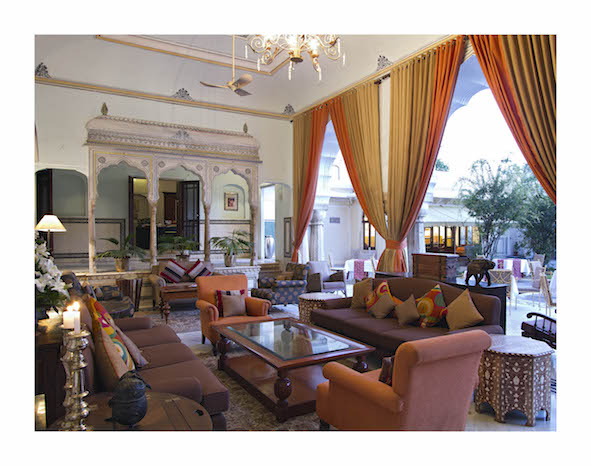
Locate an element on the screen. Image resolution: width=591 pixels, height=466 pixels. throw pillows is located at coordinates (460, 306), (431, 300), (411, 308), (381, 304), (379, 286), (168, 265), (198, 264), (230, 303), (233, 288).